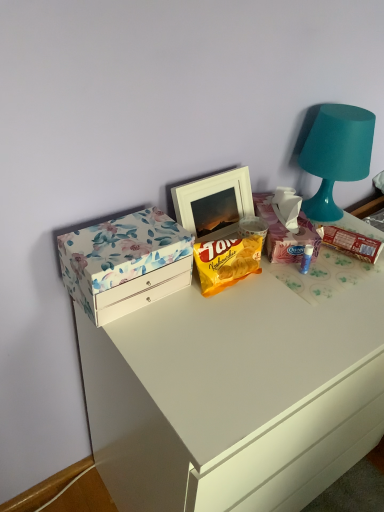
Where is `vacant space in front of brown cardboard snack at right, marked as the second snack in a left-to-right arrangement`? This screenshot has height=512, width=384. vacant space in front of brown cardboard snack at right, marked as the second snack in a left-to-right arrangement is located at coordinates (344, 287).